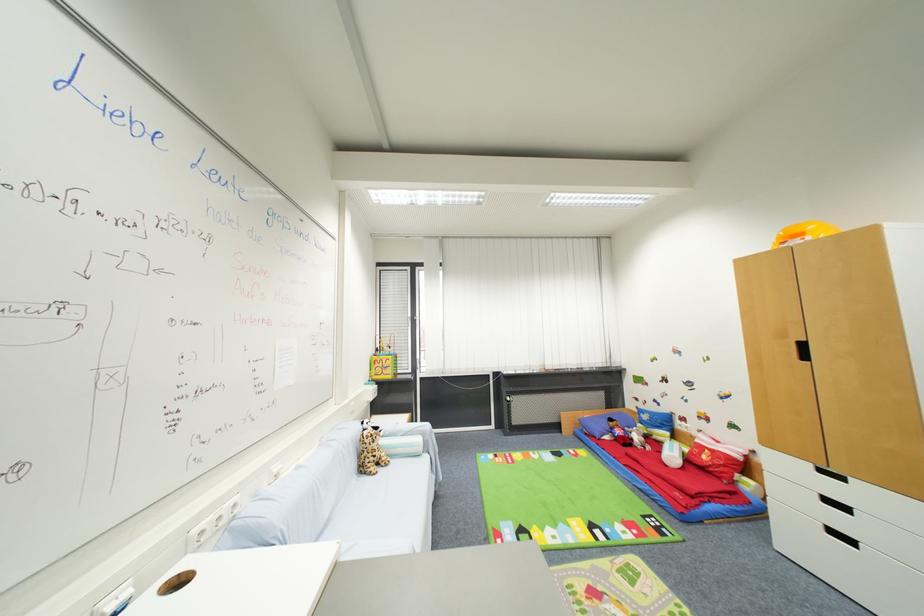
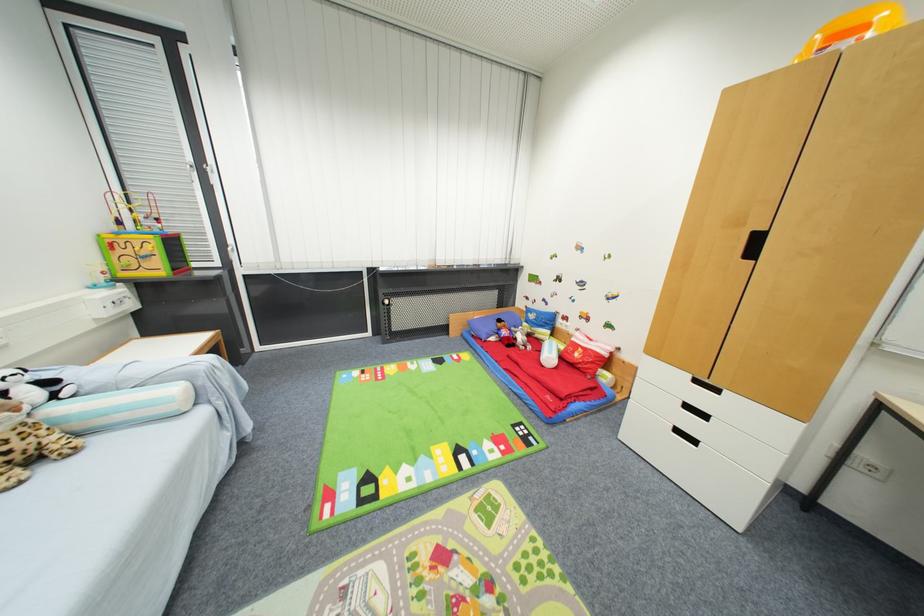
Locate, in the second image, the point that corresponds to point 615,422 in the first image.

(505, 323)